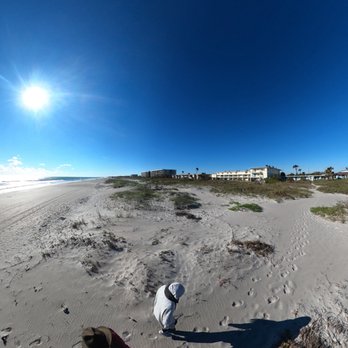
Locate an element on the screen. This screenshot has height=348, width=348. hood is located at coordinates (179, 286).